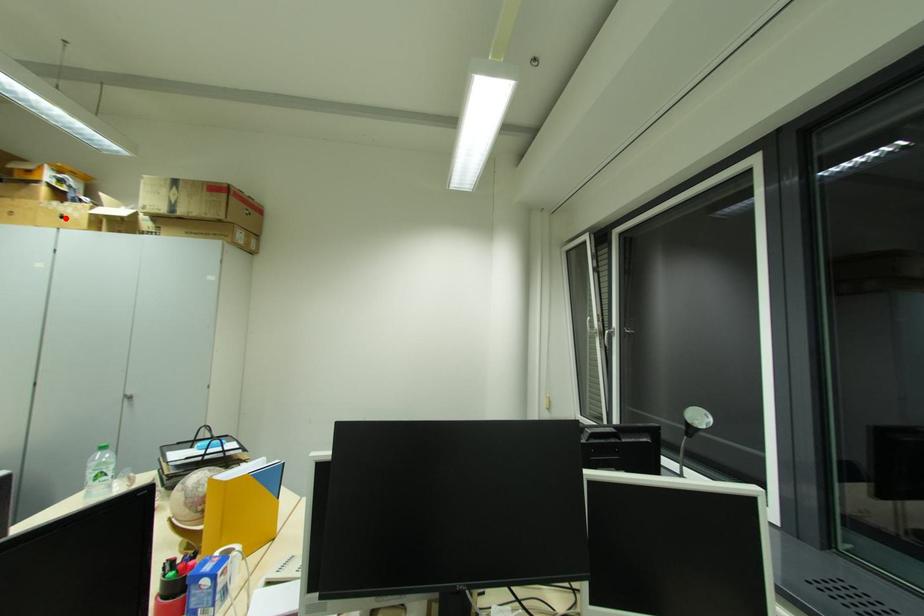
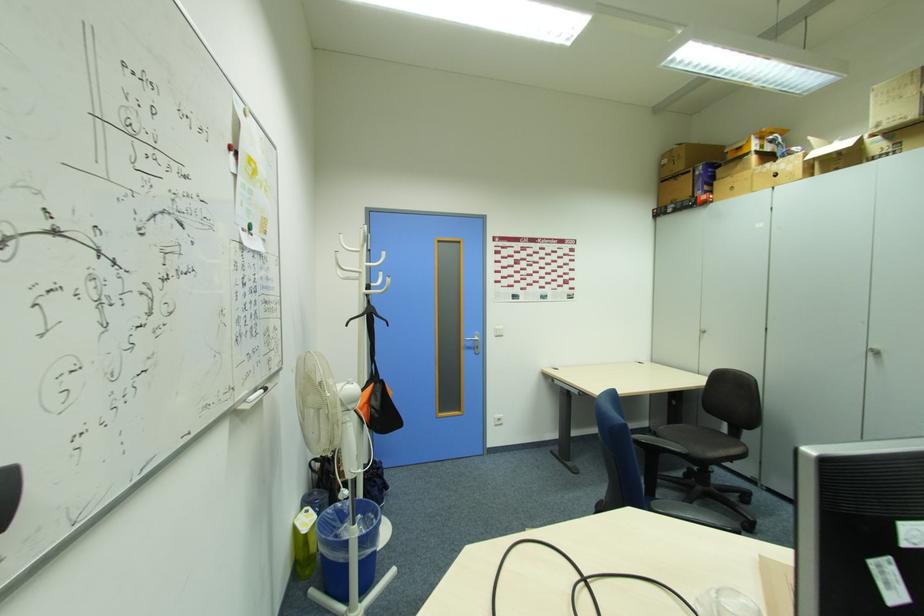
Locate, in the second image, the point that corresponds to the highlighted location in the first image.

(779, 176)